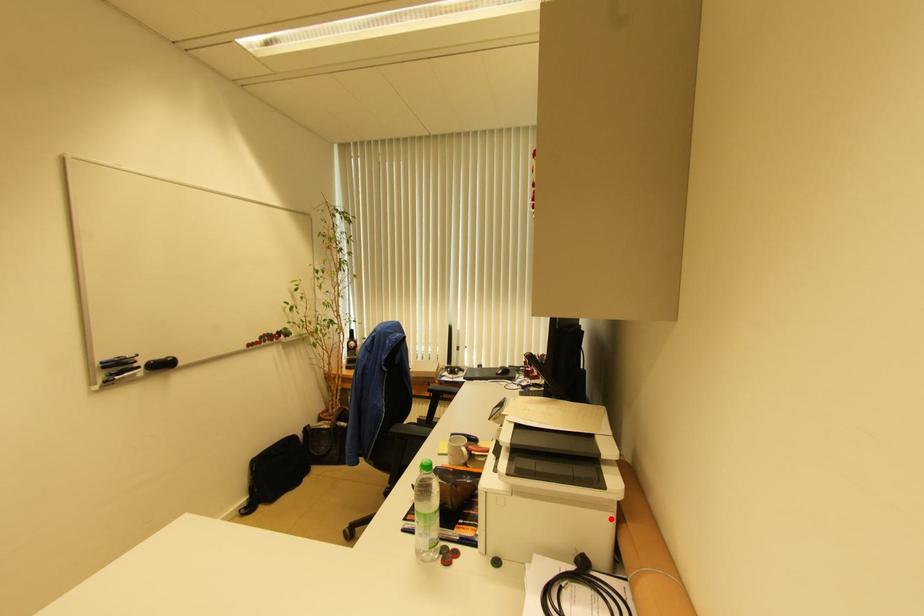
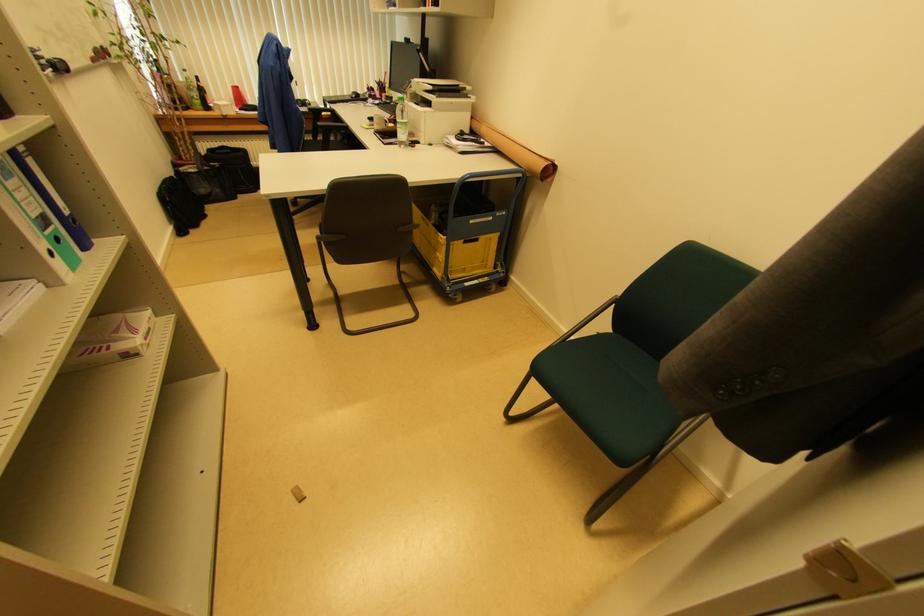
In the second image, find the point that corresponds to the highlighted location in the first image.

(469, 118)